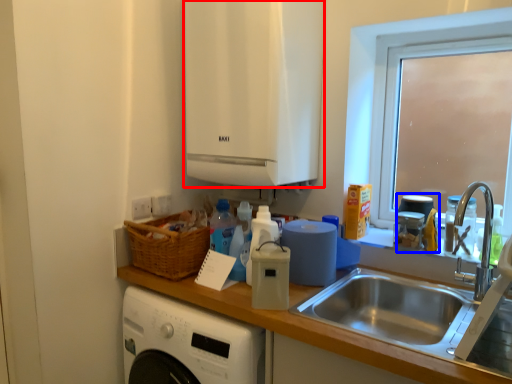
Question: Which object is closer to the camera taking this photo, cabinetry (highlighted by a red box) or appliance (highlighted by a blue box)?

Choices:
 (A) cabinetry
 (B) appliance

Answer: (A)